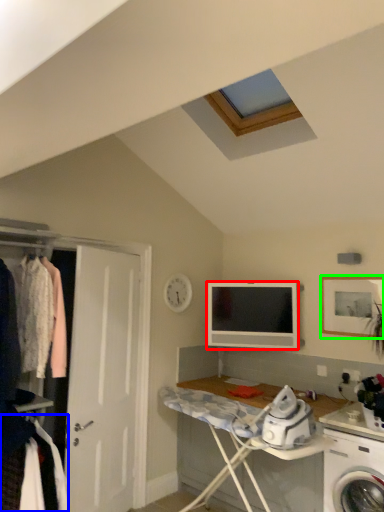
Question: Which object is the closest to the television (highlighted by a red box)? Choose among these: clothing (highlighted by a blue box) or picture frame (highlighted by a green box).

Choices:
 (A) clothing
 (B) picture frame

Answer: (B)